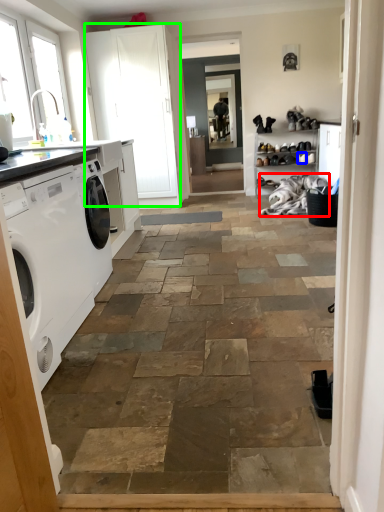
Question: Based on their relative distances, which object is nearer to laundry (highlighted by a red box)? Choose from shoe (highlighted by a blue box) and screen door (highlighted by a green box).

Choices:
 (A) shoe
 (B) screen door

Answer: (A)